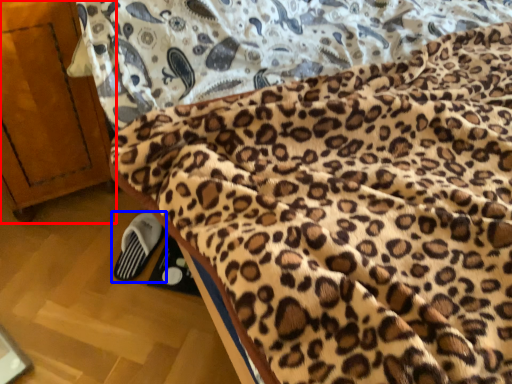
Question: Which object is further to the camera taking this photo, furniture (highlighted by a red box) or footwear (highlighted by a blue box)?

Choices:
 (A) furniture
 (B) footwear

Answer: (B)